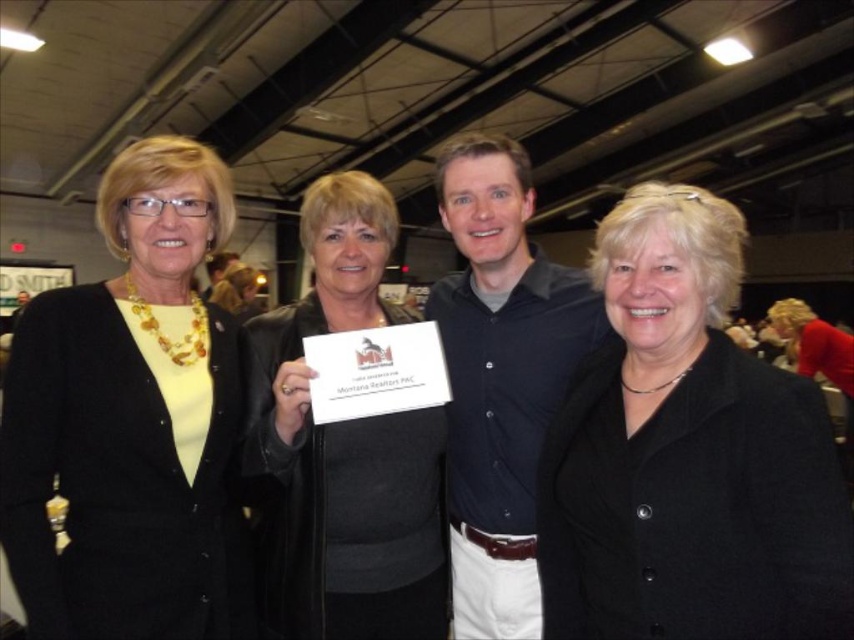
Question: Considering the relative positions of black matte jacket at center and dark blue shirt at center in the image provided, where is black matte jacket at center located with respect to dark blue shirt at center?

Choices:
 (A) above
 (B) below

Answer: (B)

Question: Which object is closer to the camera taking this photo?

Choices:
 (A) black matte jacket at center
 (B) dark blue shirt at center
 (C) yellow matte cardigan at left

Answer: (A)

Question: Is yellow matte cardigan at left thinner than red velvet dress at lower right?

Choices:
 (A) no
 (B) yes

Answer: (B)

Question: Which of the following is the closest to the observer?

Choices:
 (A) black matte jacket at center
 (B) black leather jacket at center
 (C) dark blue shirt at center

Answer: (A)

Question: Which object appears closest to the camera in this image?

Choices:
 (A) red velvet dress at lower right
 (B) dark blue shirt at center
 (C) yellow matte cardigan at left

Answer: (C)

Question: Does black leather jacket at center have a smaller size compared to dark blue shirt at center?

Choices:
 (A) no
 (B) yes

Answer: (B)